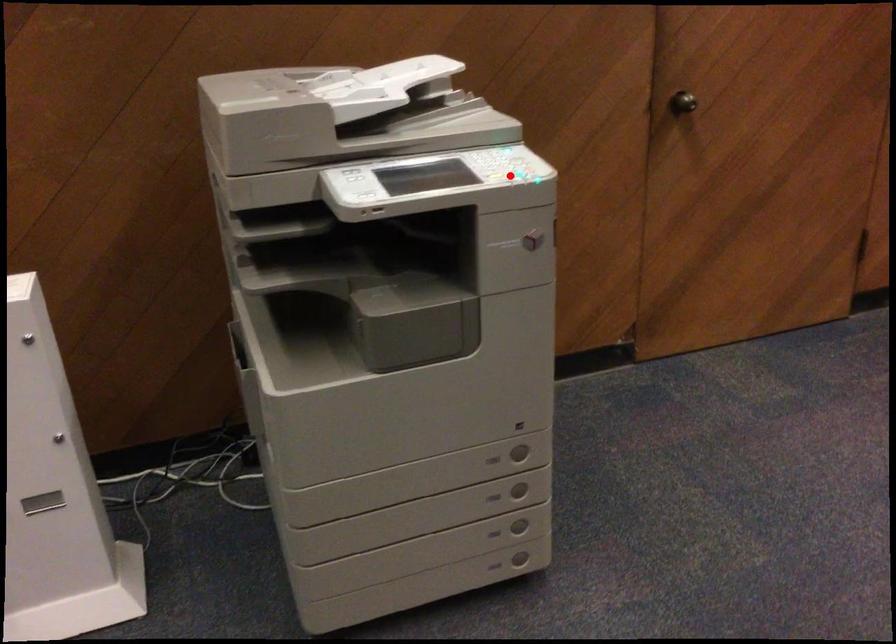
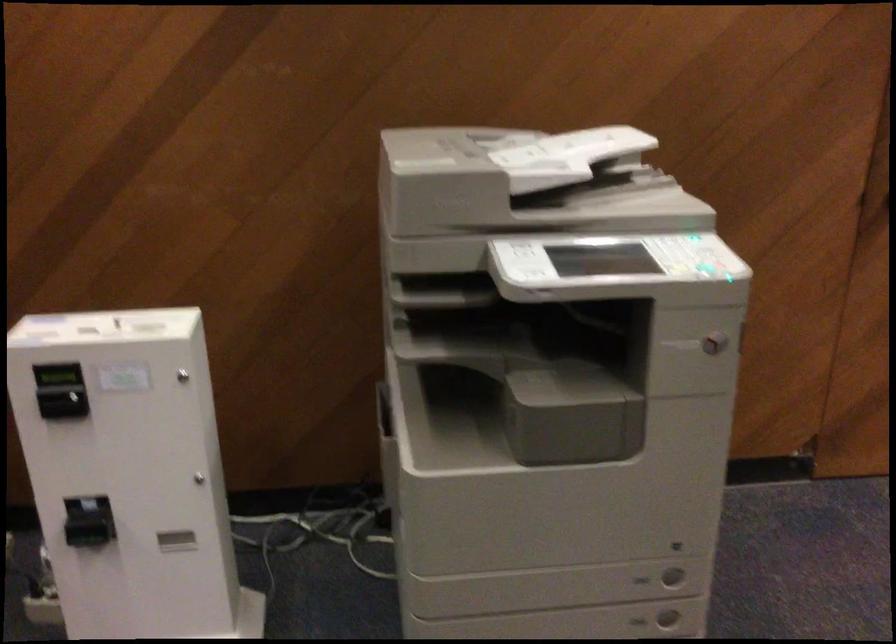
The point at the highlighted location is marked in the first image. Where is the corresponding point in the second image?

(698, 266)